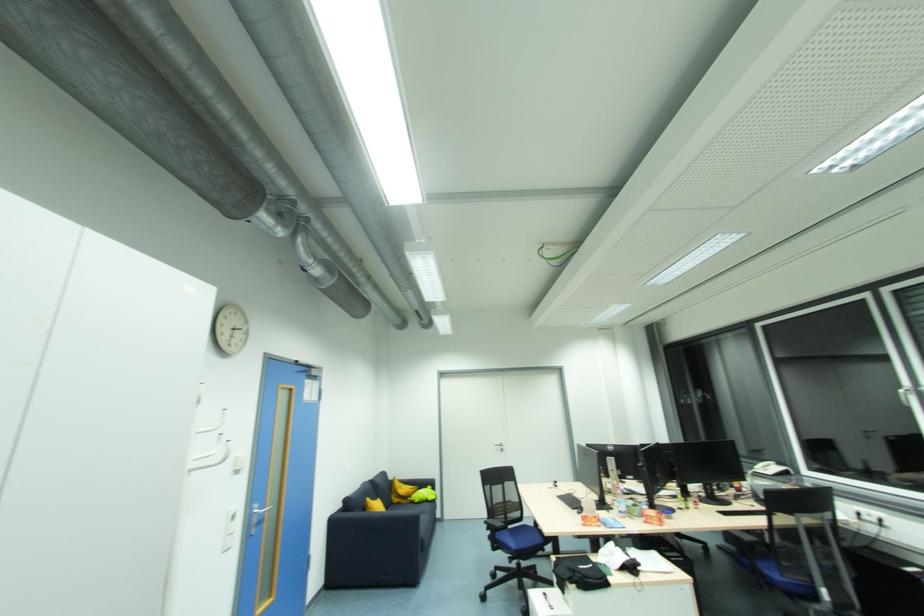
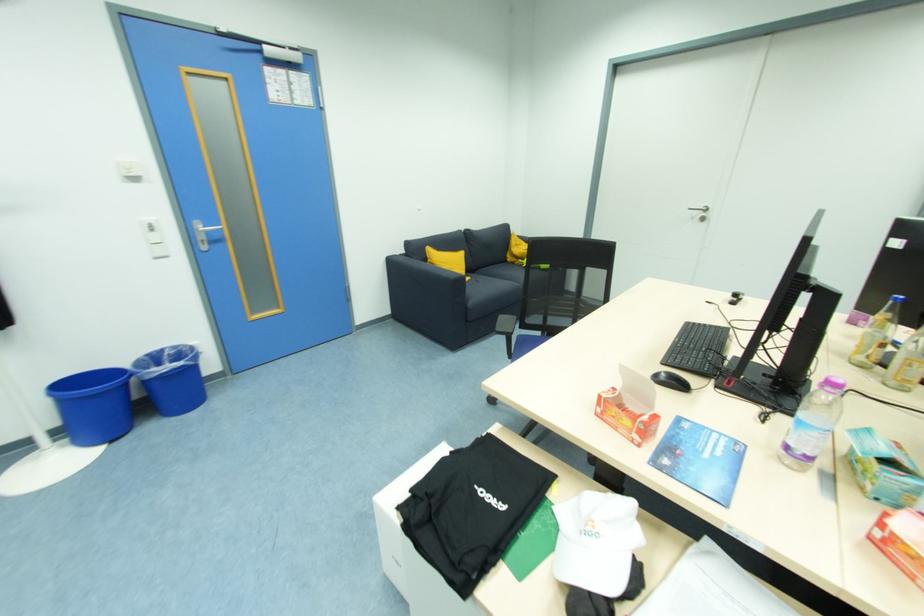
In the second image, find the point that corresponds to point 624,514 in the first image.

(792, 448)